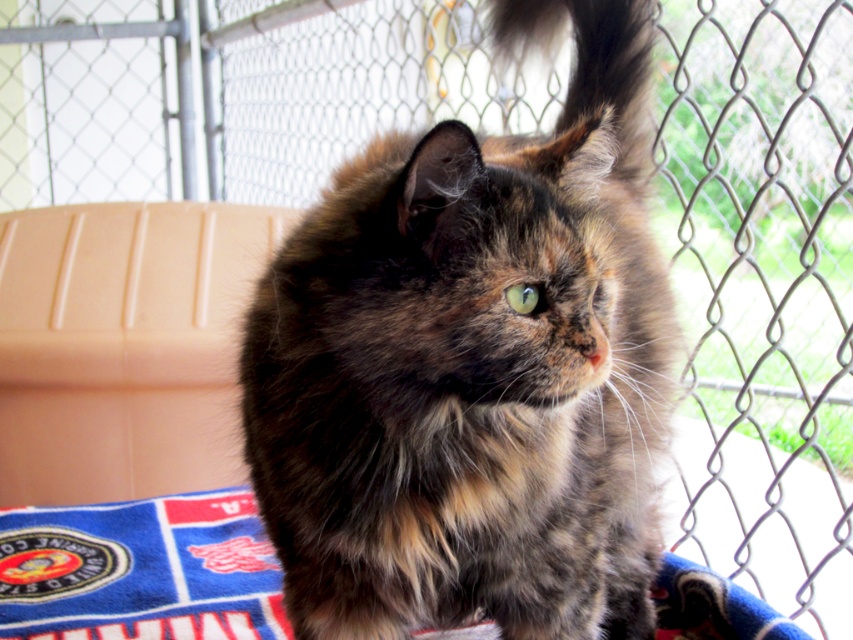
Between point (260, 515) and point (547, 10), which one is positioned behind?

Point (547, 10)

Who is shorter, fluffy tortoiseshell cat at center or fluffy tortoiseshell tail at upper right?

fluffy tortoiseshell tail at upper right

Does point (619, 147) come in front of point (625, 33)?

No.

Locate an element on the screen. fluffy tortoiseshell cat at center is located at coordinates (473, 368).

Does blue fleece mat at center lie in front of fluffy tortoiseshell tail at upper right?

Yes, it is in front of fluffy tortoiseshell tail at upper right.

In order to click on blue fleece mat at center in this screenshot , I will do `click(140, 570)`.

Who is taller, fluffy tortoiseshell cat at center or blue fleece mat at center?

fluffy tortoiseshell cat at center

Describe the element at coordinates (473, 368) in the screenshot. Image resolution: width=853 pixels, height=640 pixels. I see `fluffy tortoiseshell cat at center` at that location.

At what (x,y) coordinates should I click in order to perform the action: click on fluffy tortoiseshell cat at center. Please return your answer as a coordinate pair (x, y). The image size is (853, 640). Looking at the image, I should click on (473, 368).